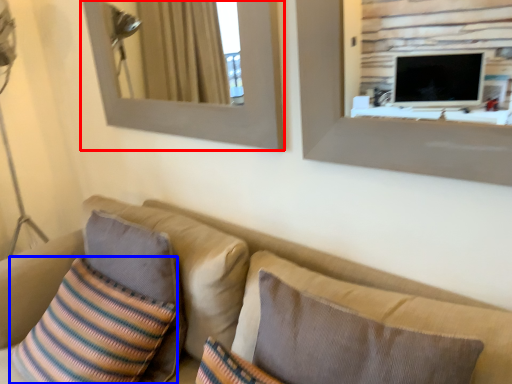
Question: Which object appears farthest to the camera in this image, picture frame (highlighted by a red box) or throw pillow (highlighted by a blue box)?

Choices:
 (A) picture frame
 (B) throw pillow

Answer: (A)